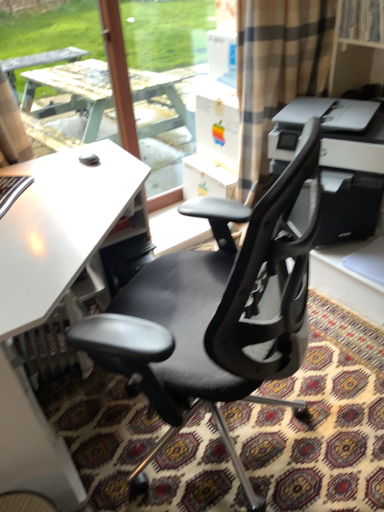
Find the location of a particular element. The width and height of the screenshot is (384, 512). white matte desk at center is located at coordinates (51, 294).

Describe the element at coordinates (51, 294) in the screenshot. Image resolution: width=384 pixels, height=512 pixels. I see `white matte desk at center` at that location.

This screenshot has width=384, height=512. In order to click on white plastic printer at upper right in this screenshot , I will do `click(338, 162)`.

Measure the distance between black mesh office chair at center and white matte desk at center.

black mesh office chair at center and white matte desk at center are 14.03 inches apart from each other.

Does black mesh office chair at center turn towards white matte desk at center?

Yes, black mesh office chair at center is oriented towards white matte desk at center.

From a real-world perspective, does black mesh office chair at center sit lower than white matte desk at center?

Incorrect, from a real-world perspective, black mesh office chair at center is higher than white matte desk at center.

Is black mesh office chair at center next to white matte desk at center?

No, black mesh office chair at center is not with white matte desk at center.

Is white matte desk at center not within black mesh office chair at center?

Yes, white matte desk at center is not within black mesh office chair at center.

Is white matte desk at center taller or shorter than black mesh office chair at center?

Considering their sizes, white matte desk at center has less height than black mesh office chair at center.

Can you tell me how much white matte desk at center and black mesh office chair at center differ in facing direction?

The angle between the facing direction of white matte desk at center and the facing direction of black mesh office chair at center is 149 degrees.

Between point (75, 483) and point (168, 298), which one is positioned behind?

Point (168, 298)

How many degrees apart are the facing directions of white plastic printer at upper right and white matte desk at center?

The angle between the facing direction of white plastic printer at upper right and the facing direction of white matte desk at center is 65.6 degrees.

Are white plastic printer at upper right and white matte desk at center making contact?

There is a gap between white plastic printer at upper right and white matte desk at center.

Does white plastic printer at upper right have a greater height compared to white matte desk at center?

In fact, white plastic printer at upper right may be shorter than white matte desk at center.

Is point (373, 187) farther from viewer compared to point (53, 447)?

Yes, it is.

From the image's perspective, is white plastic printer at upper right on black mesh office chair at center?

Yes, from the image's perspective, white plastic printer at upper right is over black mesh office chair at center.

In the scene shown: From a real-world perspective, is white plastic printer at upper right physically below black mesh office chair at center?

Actually, white plastic printer at upper right is physically above black mesh office chair at center in the real world.

Is white plastic printer at upper right oriented away from black mesh office chair at center?

That's not correct — white plastic printer at upper right is not looking away from black mesh office chair at center.

Consider the image. Considering the sizes of objects white plastic printer at upper right and black mesh office chair at center in the image provided, who is taller, white plastic printer at upper right or black mesh office chair at center?

With more height is black mesh office chair at center.

Is white matte desk at center turned away from white plastic printer at upper right?

That's not correct — white matte desk at center is not looking away from white plastic printer at upper right.

Is white matte desk at center inside the boundaries of white plastic printer at upper right, or outside?

The correct answer is: outside.

From a real-world perspective, who is located lower, white matte desk at center or white plastic printer at upper right?

From a 3D spatial view, white matte desk at center is below.

I want to click on desk located below the white plastic printer at upper right (from the image's perspective), so click(51, 294).

Considering the positions of objects black mesh office chair at center and white plastic printer at upper right in the image provided, who is more to the left, black mesh office chair at center or white plastic printer at upper right?

black mesh office chair at center.

From the image's perspective, is black mesh office chair at center located beneath white plastic printer at upper right?

Indeed, from the image's perspective, black mesh office chair at center is shown beneath white plastic printer at upper right.

Between black mesh office chair at center and white plastic printer at upper right, which one is positioned in front?

black mesh office chair at center is more forward.

Is black mesh office chair at center wider or thinner than white plastic printer at upper right?

black mesh office chair at center is wider than white plastic printer at upper right.

The image size is (384, 512). Find the location of `desk beneath the black mesh office chair at center (from a real-world perspective)`. desk beneath the black mesh office chair at center (from a real-world perspective) is located at coordinates (51, 294).

You are a GUI agent. You are given a task and a screenshot of the screen. Output one action in this format:
    pyautogui.click(x=<x>, y=<y>)
    Task: Click on the chair on the right side of white matte desk at center
    This screenshot has width=384, height=512.
    Given the screenshot: What is the action you would take?
    pyautogui.click(x=214, y=315)

Considering their positions, is white plastic printer at upper right positioned closer to white matte desk at center than black mesh office chair at center?

black mesh office chair at center is positioned closer to the anchor white matte desk at center.

When comparing their distances from black mesh office chair at center, does white matte desk at center or white plastic printer at upper right seem further?

white plastic printer at upper right.

Considering their positions, is white plastic printer at upper right positioned closer to black mesh office chair at center than white matte desk at center?

white matte desk at center is positioned closer to the anchor black mesh office chair at center.

When comparing their distances from white plastic printer at upper right, does white matte desk at center or black mesh office chair at center seem further?

The object further to white plastic printer at upper right is white matte desk at center.

Looking at the image, which one is located closer to white matte desk at center, black mesh office chair at center or white plastic printer at upper right?

black mesh office chair at center.

Estimate the real-world distances between objects in this image. Which object is closer to white plastic printer at upper right, black mesh office chair at center or white matte desk at center?

black mesh office chair at center is closer to white plastic printer at upper right.

Where is `chair between white matte desk at center and white plastic printer at upper right in the horizontal direction`? The width and height of the screenshot is (384, 512). chair between white matte desk at center and white plastic printer at upper right in the horizontal direction is located at coordinates (214, 315).